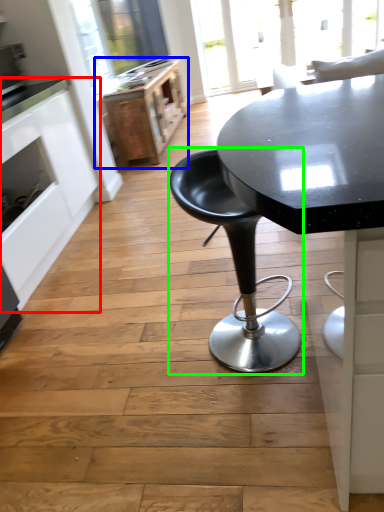
Question: Based on their relative distances, which object is farther from cabinetry (highlighted by a red box)? Choose from file cabinet (highlighted by a blue box) and chair (highlighted by a green box).

Choices:
 (A) file cabinet
 (B) chair

Answer: (A)